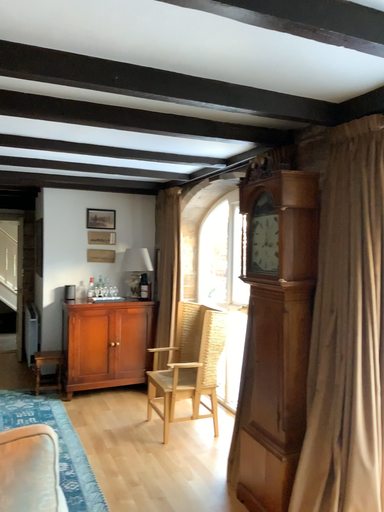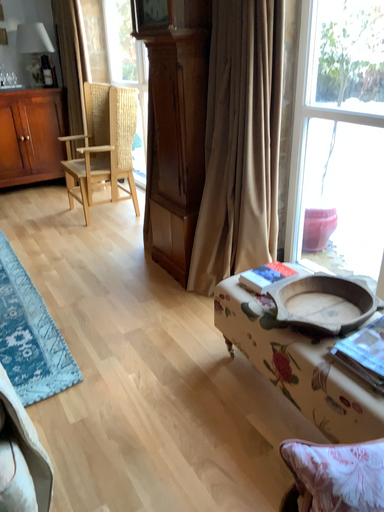
Question: Which way did the camera rotate in the video?

Choices:
 (A) rotated right
 (B) rotated left

Answer: (A)